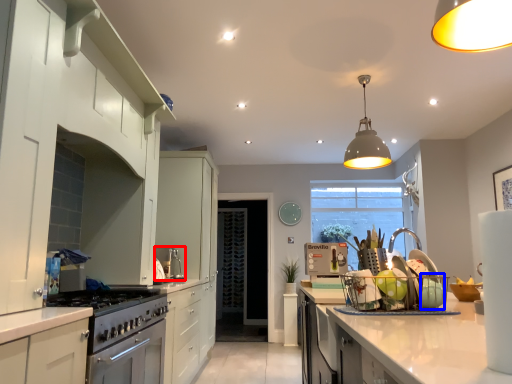
Question: Which point is closer to the camera, appliance (highlighted by a red box) or appliance (highlighted by a blue box)?

Choices:
 (A) appliance
 (B) appliance

Answer: (B)